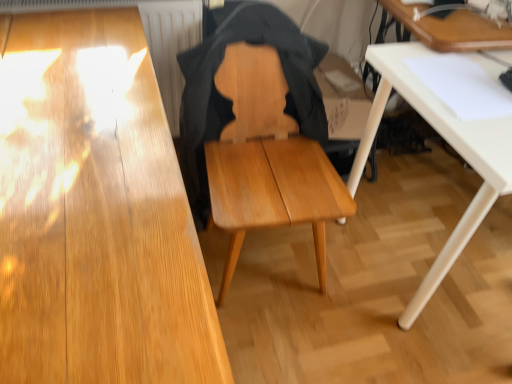
Question: From the image's perspective, is wooden table at upper right, which is the first table from top to bottom, below white matte table at lower right, arranged as the 1th table when ordered from the bottom?

Choices:
 (A) yes
 (B) no

Answer: (B)

Question: Could white matte table at lower right, positioned as the 2th table in top-to-bottom order, be considered to be inside wooden table at upper right, which is the first table from top to bottom?

Choices:
 (A) yes
 (B) no

Answer: (B)

Question: Can you confirm if wooden table at upper right, which is the first table from top to bottom, is bigger than white matte table at lower right, arranged as the 1th table when ordered from the bottom?

Choices:
 (A) no
 (B) yes

Answer: (A)

Question: From a real-world perspective, is wooden table at upper right, marked as the 2th table in a bottom-to-top arrangement, physically above white matte table at lower right, positioned as the 2th table in top-to-bottom order?

Choices:
 (A) yes
 (B) no

Answer: (A)

Question: From the image's perspective, would you say wooden table at upper right, which is the first table from top to bottom, is positioned over white matte table at lower right, arranged as the 1th table when ordered from the bottom?

Choices:
 (A) no
 (B) yes

Answer: (B)

Question: Is wooden table at upper right, which is the first table from top to bottom, located outside white matte table at lower right, arranged as the 1th table when ordered from the bottom?

Choices:
 (A) yes
 (B) no

Answer: (A)

Question: Can you confirm if light brown wood chair at center is wider than wooden table at upper right, which is the first table from top to bottom?

Choices:
 (A) no
 (B) yes

Answer: (B)

Question: Is light brown wood chair at center positioned before wooden table at upper right, which is the first table from top to bottom?

Choices:
 (A) no
 (B) yes

Answer: (B)

Question: From a real-world perspective, is light brown wood chair at center on wooden table at upper right, which is the first table from top to bottom?

Choices:
 (A) yes
 (B) no

Answer: (B)

Question: Considering the relative sizes of light brown wood chair at center and wooden table at upper right, marked as the 2th table in a bottom-to-top arrangement, in the image provided, is light brown wood chair at center thinner than wooden table at upper right, marked as the 2th table in a bottom-to-top arrangement,?

Choices:
 (A) no
 (B) yes

Answer: (A)

Question: From the image's perspective, is light brown wood chair at center below wooden table at upper right, marked as the 2th table in a bottom-to-top arrangement?

Choices:
 (A) no
 (B) yes

Answer: (B)

Question: Considering the relative sizes of light brown wood chair at center and wooden table at upper right, marked as the 2th table in a bottom-to-top arrangement, in the image provided, is light brown wood chair at center bigger than wooden table at upper right, marked as the 2th table in a bottom-to-top arrangement,?

Choices:
 (A) no
 (B) yes

Answer: (B)

Question: From the image's perspective, is white matte table at lower right, positioned as the 2th table in top-to-bottom order, over wooden table at upper right, marked as the 2th table in a bottom-to-top arrangement?

Choices:
 (A) yes
 (B) no

Answer: (B)